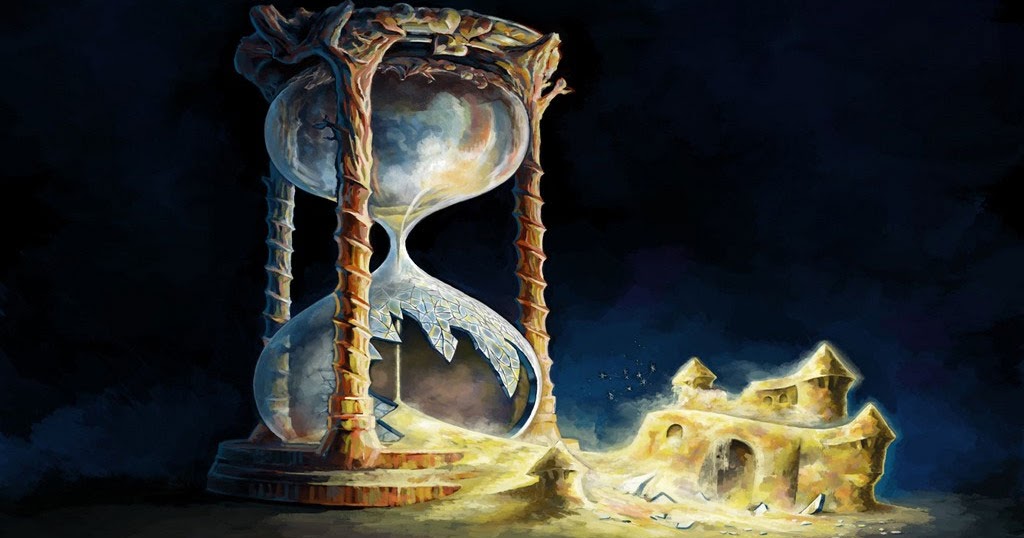
What are the coordinates of `hourglass` in the screenshot? It's located at (424, 121).